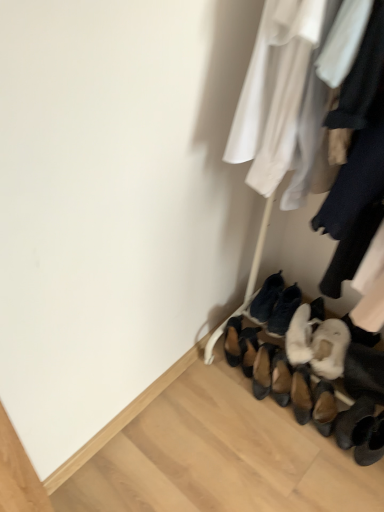
Image resolution: width=384 pixels, height=512 pixels. In order to click on empty space that is ontop of white fluffy slippers at lower right, which is the 6th footwear from left to right (from a real-world perspective) in this screenshot , I will do `click(340, 340)`.